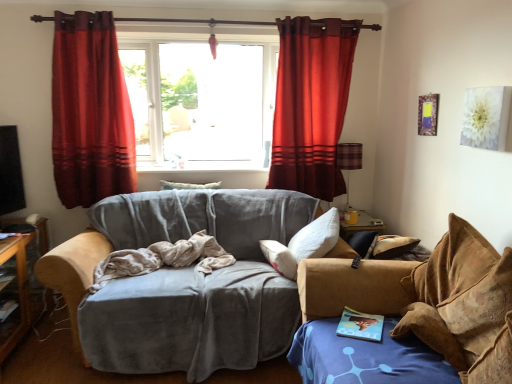
Question: Should I look upward or downward to see rich red velvet curtain at upper center, positioned as the 2th curtain in left-to-right order?

Choices:
 (A) down
 (B) up

Answer: (B)

Question: Is brown suede studio couch at right, the first studio couch positioned from the right, surrounding beige fabric blanket at center?

Choices:
 (A) yes
 (B) no

Answer: (B)

Question: Is brown suede studio couch at right, which is the second studio couch in left-to-right order, located outside beige fabric blanket at center?

Choices:
 (A) yes
 (B) no

Answer: (A)

Question: Can you see brown suede studio couch at right, which is the second studio couch in left-to-right order, touching beige fabric blanket at center?

Choices:
 (A) yes
 (B) no

Answer: (B)

Question: Is brown suede studio couch at right, which is the second studio couch in left-to-right order, shorter than beige fabric blanket at center?

Choices:
 (A) yes
 (B) no

Answer: (B)

Question: From the image's perspective, is brown suede studio couch at right, which is the second studio couch in left-to-right order, below beige fabric blanket at center?

Choices:
 (A) yes
 (B) no

Answer: (A)

Question: Is brown suede studio couch at right, the first studio couch positioned from the right, looking in the opposite direction of beige fabric blanket at center?

Choices:
 (A) no
 (B) yes

Answer: (A)

Question: Is transparent glass window at center shorter than beige fabric blanket at center?

Choices:
 (A) yes
 (B) no

Answer: (B)

Question: Can you confirm if transparent glass window at center is wider than beige fabric blanket at center?

Choices:
 (A) no
 (B) yes

Answer: (A)

Question: Is transparent glass window at center behind beige fabric blanket at center?

Choices:
 (A) no
 (B) yes

Answer: (B)

Question: Can you confirm if transparent glass window at center is thinner than beige fabric blanket at center?

Choices:
 (A) no
 (B) yes

Answer: (B)

Question: Is transparent glass window at center facing away from beige fabric blanket at center?

Choices:
 (A) yes
 (B) no

Answer: (B)

Question: Is transparent glass window at center aimed at beige fabric blanket at center?

Choices:
 (A) no
 (B) yes

Answer: (A)

Question: Can you confirm if beige fabric blanket at center is smaller than velvet gray couch at center, the second studio couch viewed from the right?

Choices:
 (A) no
 (B) yes

Answer: (B)